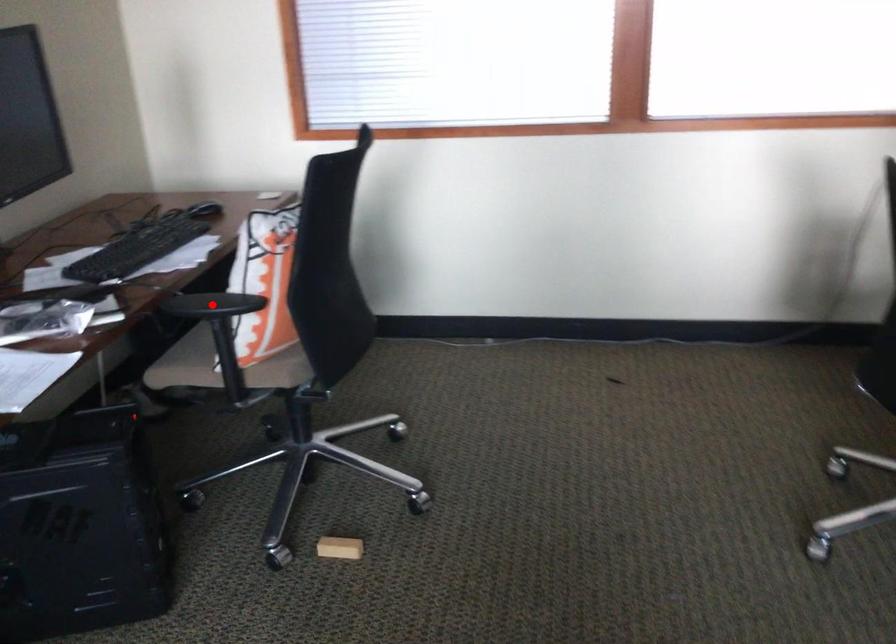
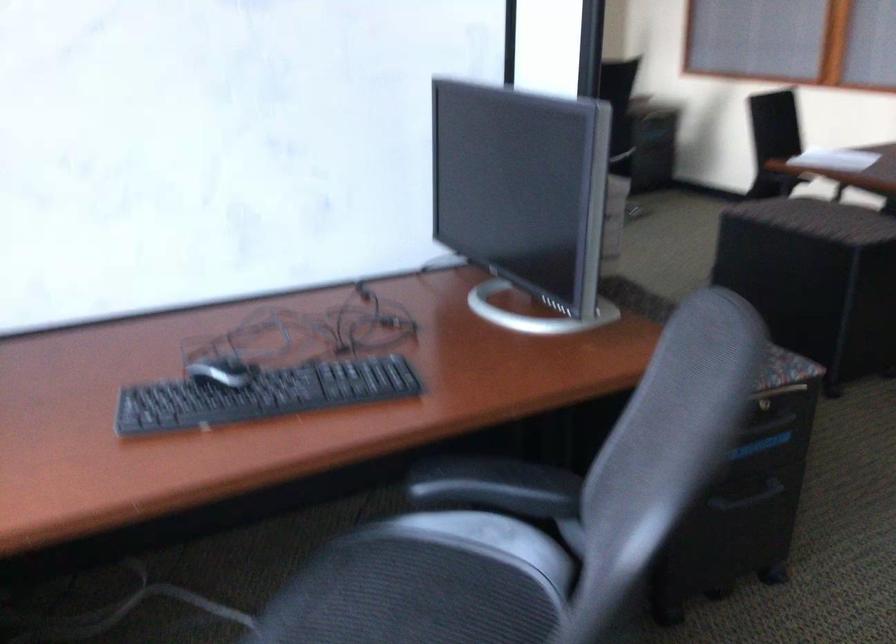
Question: I am providing you with two images of the same scene from different viewpoints. A red point is marked on the first image. At the location where the point appears in image 1, is it still visible in image 2?

Choices:
 (A) Yes
 (B) No

Answer: (B)